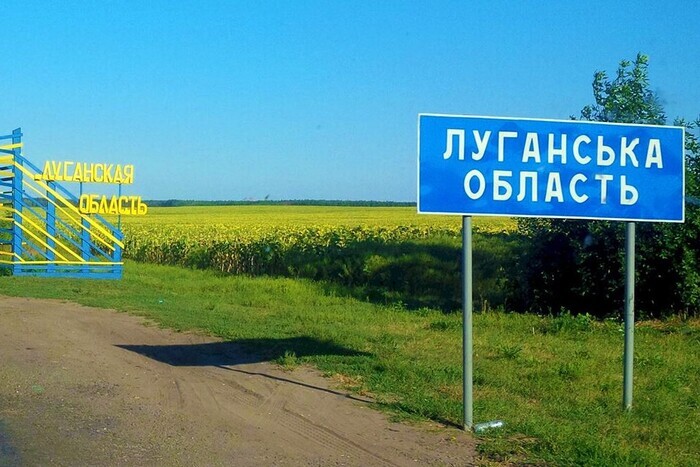
The height and width of the screenshot is (467, 700). Identify the location of tall green plants. (631, 93), (659, 260), (579, 255).